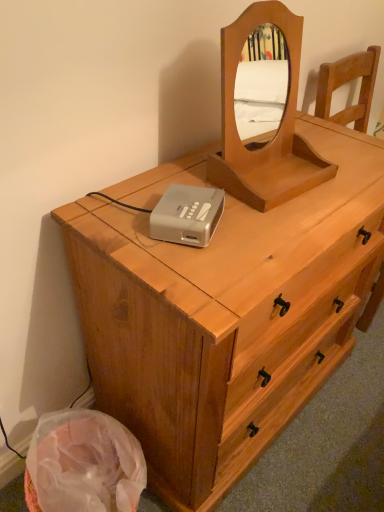
Find the location of a particular element. This screenshot has width=384, height=512. vacant space behind silver plastic cassette at center is located at coordinates (162, 177).